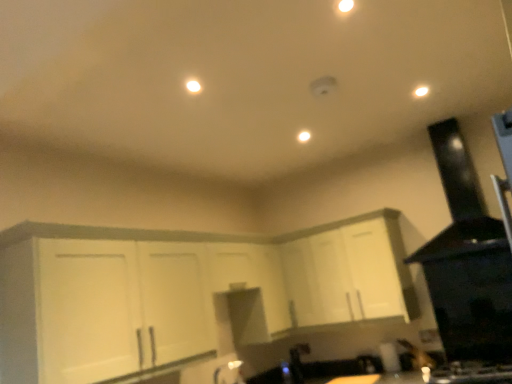
Question: Would you say black matte exhaust hood at upper right is to the left or to the right of white matte cabinet at center, the first cabinetry viewed from the right, in the picture?

Choices:
 (A) left
 (B) right

Answer: (B)

Question: Does point pyautogui.click(x=443, y=233) appear closer or farther from the camera than point pyautogui.click(x=355, y=246)?

Choices:
 (A) closer
 (B) farther

Answer: (A)

Question: Considering the real-world distances, which object is closest to the matte white light at center, the first light from the back?

Choices:
 (A) black glossy gas stove at lower right
 (B) white matte cabinet at center, the first cabinetry viewed from the right
 (C) white glossy faucet at lower center
 (D) white glossy light at upper right, which is the 1th light from top to bottom
 (E) white matte cabinet at center, acting as the first cabinetry starting from the left

Answer: (D)

Question: Which is farther from the white glossy light at upper right, marked as the second light in a bottom-to-top arrangement?

Choices:
 (A) white matte cabinet at center, which ranks as the 2th cabinetry in left-to-right order
 (B) white matte cabinet at center, the 2th cabinetry viewed from the right
 (C) black glossy gas stove at lower right
 (D) white glossy faucet at lower center
 (E) matte white light at center, the 1th light when ordered from bottom to top

Answer: (D)